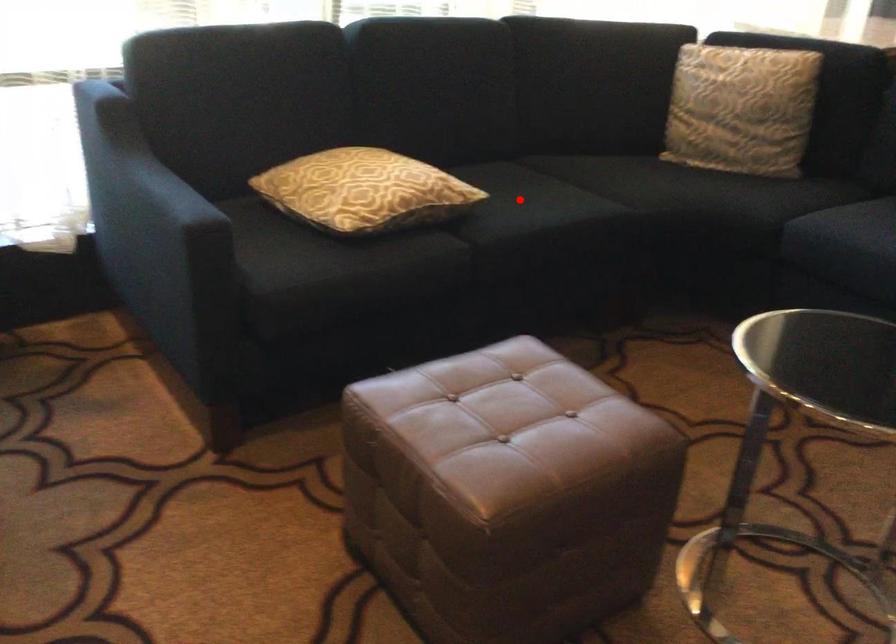
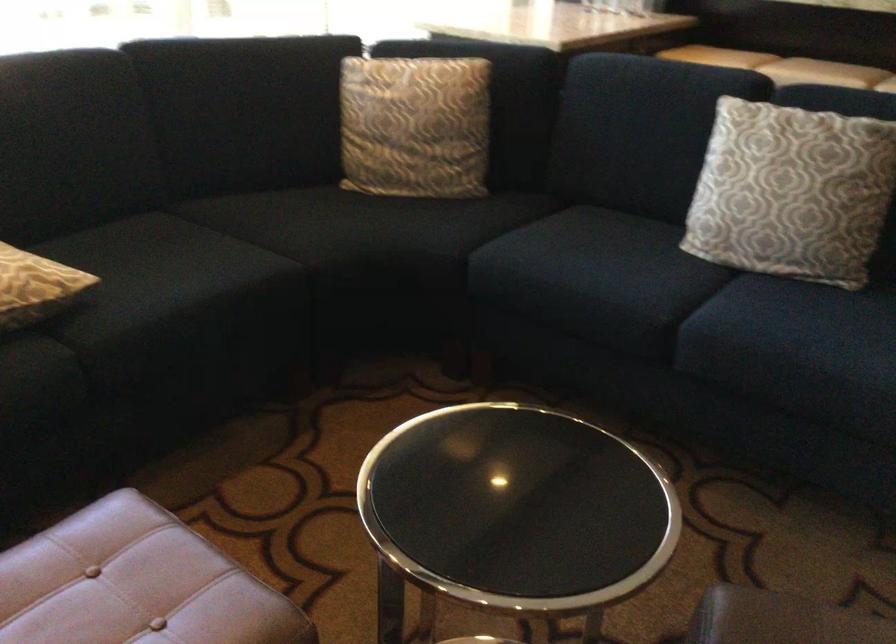
The point at the highlighted location is marked in the first image. Where is the corresponding point in the second image?

(161, 270)